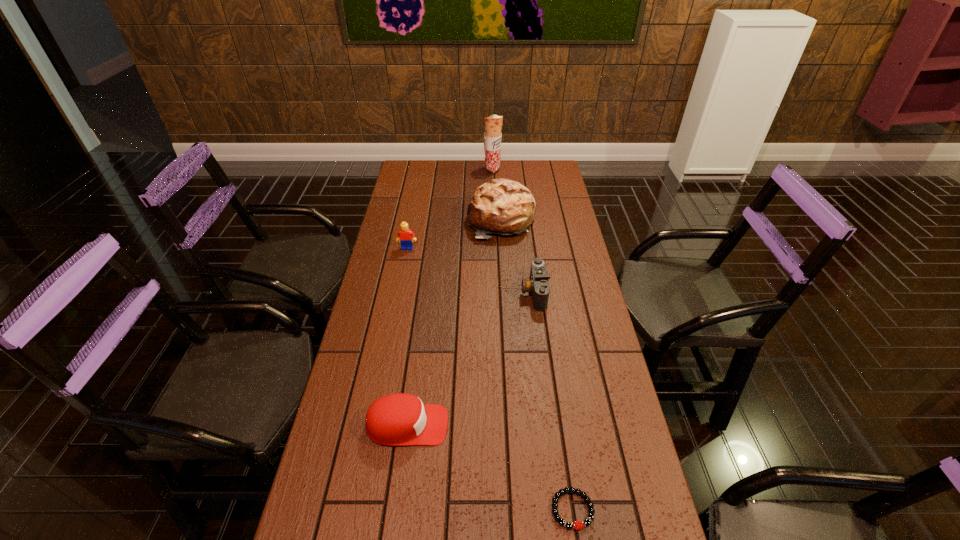
Where is `vacant space that is in between the camera and the fifth farthest object`? This screenshot has width=960, height=540. vacant space that is in between the camera and the fifth farthest object is located at coordinates (470, 359).

Image resolution: width=960 pixels, height=540 pixels. What are the coordinates of `free area in between the second tallest object and the Lego` in the screenshot? It's located at (454, 234).

The height and width of the screenshot is (540, 960). In order to click on vacant area that lies between the Lego and the tallest object in this screenshot , I will do `click(450, 209)`.

Where is `empty location between the shortest object and the fifth shortest object`? The image size is (960, 540). empty location between the shortest object and the fifth shortest object is located at coordinates (537, 365).

Locate an element on the screen. free point between the third farthest object and the camera is located at coordinates (470, 270).

You are a GUI agent. You are given a task and a screenshot of the screen. Output one action in this format:
    pyautogui.click(x=<x>, y=<y>)
    Task: Click on the free space between the fourth farthest object and the Lego
    The image size is (960, 540).
    Given the screenshot: What is the action you would take?
    pyautogui.click(x=470, y=270)

Find the location of a particular element. The height and width of the screenshot is (540, 960). free space between the bracelet and the fifth nearest object is located at coordinates (537, 365).

Find the location of a particular element. Image resolution: width=960 pixels, height=540 pixels. the fourth closest object to the second tallest object is located at coordinates (400, 419).

This screenshot has width=960, height=540. Identify the location of object that stands as the fourth closest to the burrito. (400, 419).

At what (x,y) coordinates should I click in order to perform the action: click on vacant space that satisfies the following two spatial constraints: 1. on the face of the shortest object; 2. on the right side of the fourth nearest object. Please return your answer as a coordinate pair (x, y). This screenshot has width=960, height=540. Looking at the image, I should click on (356, 509).